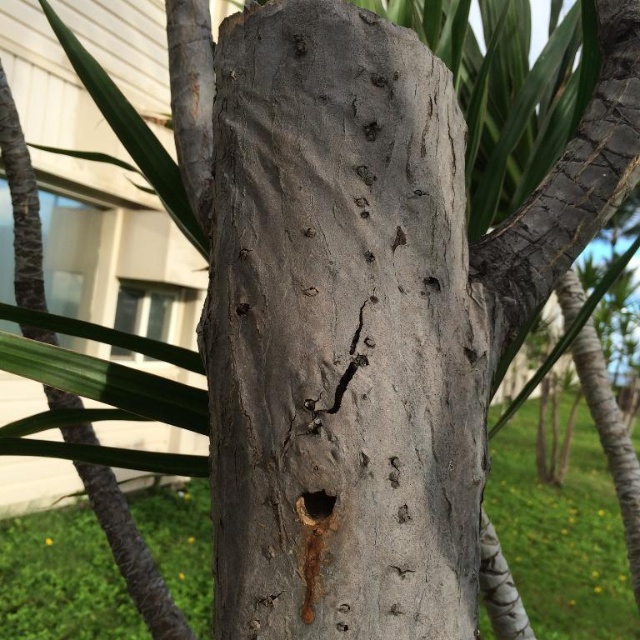
Question: Is gray rough bark tree trunk at center thinner than smooth dark brown hole at center?

Choices:
 (A) no
 (B) yes

Answer: (A)

Question: Which point is farther to the camera?

Choices:
 (A) (384, 36)
 (B) (305, 518)

Answer: (A)

Question: Is the position of gray rough bark tree trunk at center less distant than that of smooth dark brown hole at center?

Choices:
 (A) yes
 (B) no

Answer: (A)

Question: Is gray rough bark tree trunk at center further to the viewer compared to smooth dark brown hole at center?

Choices:
 (A) yes
 (B) no

Answer: (B)

Question: Which of the following is the farthest from the observer?

Choices:
 (A) (214, 440)
 (B) (298, 513)

Answer: (A)